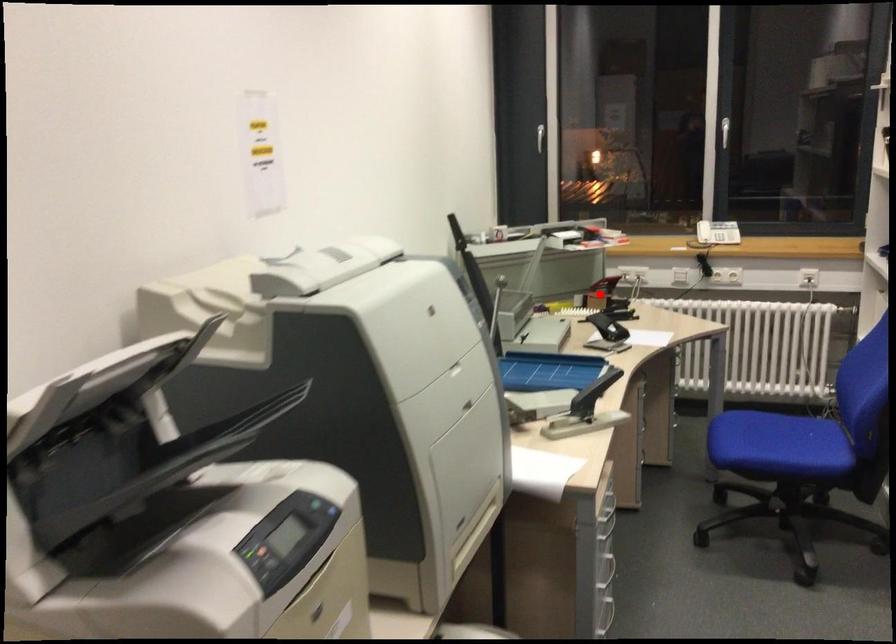
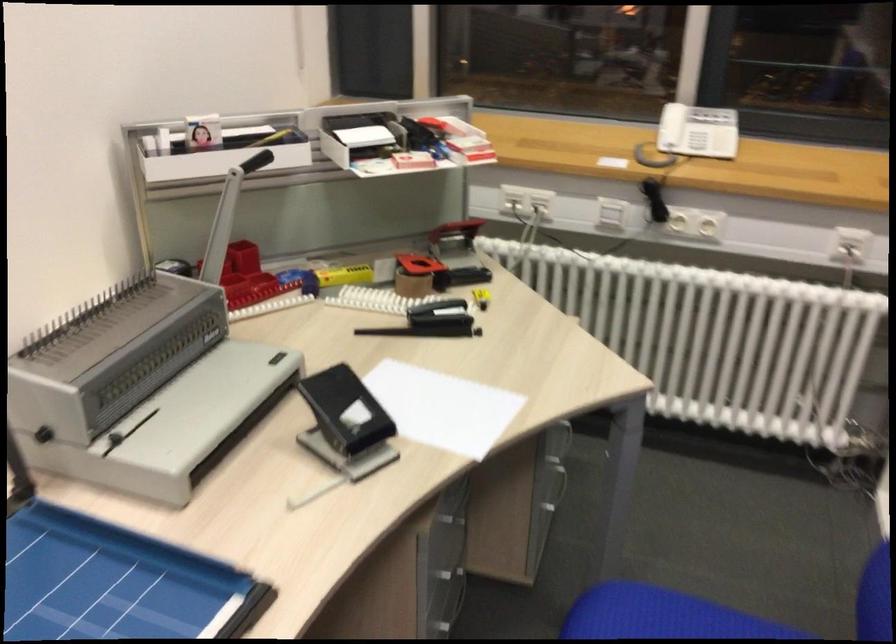
Find the pixel in the second image that matches the highlighted location in the first image.

(414, 272)